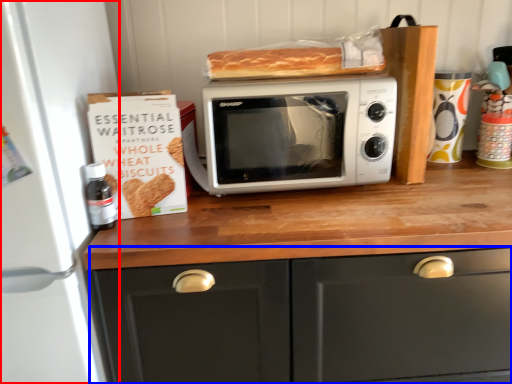
Question: Which object appears farthest to the camera in this image, appliance (highlighted by a red box) or cabinetry (highlighted by a blue box)?

Choices:
 (A) appliance
 (B) cabinetry

Answer: (B)